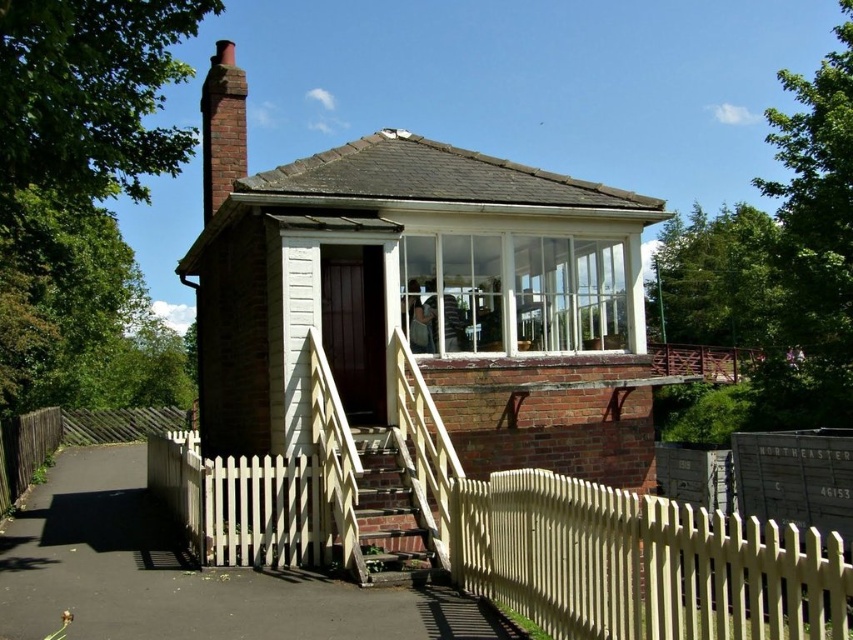
You are standing outside the building and want to enter through the entrance. Which object must you pass by first, the white picket fence at lower center or the brick chimney at upper left?

The white picket fence at lower center is in front of the brick chimney at upper left, so you must pass by the white picket fence at lower center first to reach the entrance.

From the picture: You are a painter hired to paint the white picket fence at lower center and the white picket fence at lower right. Which fence requires a taller ladder to reach its top?

The white picket fence at lower center requires a taller ladder because it has a greater height compared to the white picket fence at lower right.

You are standing in front of the building and want to enter through the entrance. Which object, the white picket fence at lower center or the brick chimney at upper left, is closer to you as you approach the entrance?

The white picket fence at lower center is closer to you as you approach the entrance because it is located below the brick chimney at upper left, meaning it is positioned lower and nearer to the ground level where the entrance is situated.